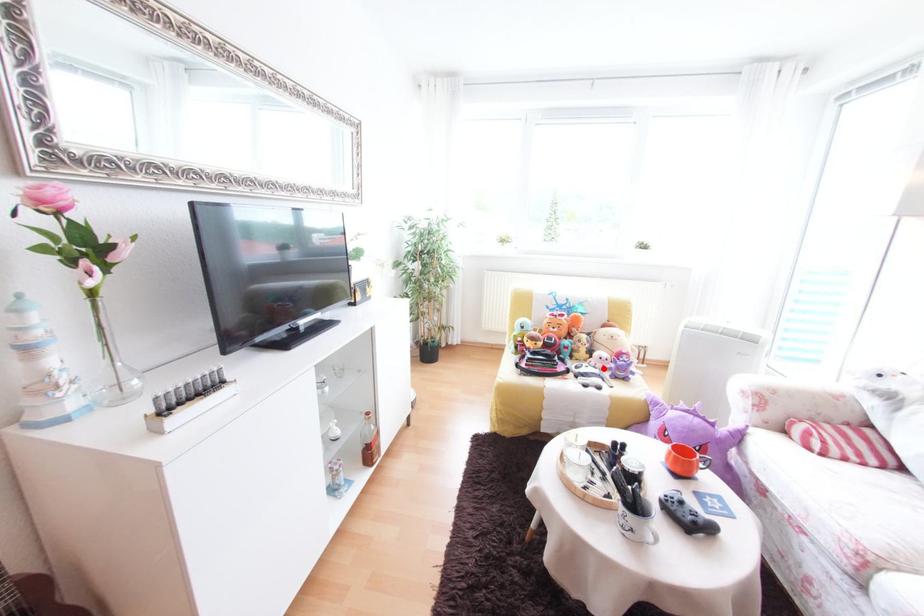
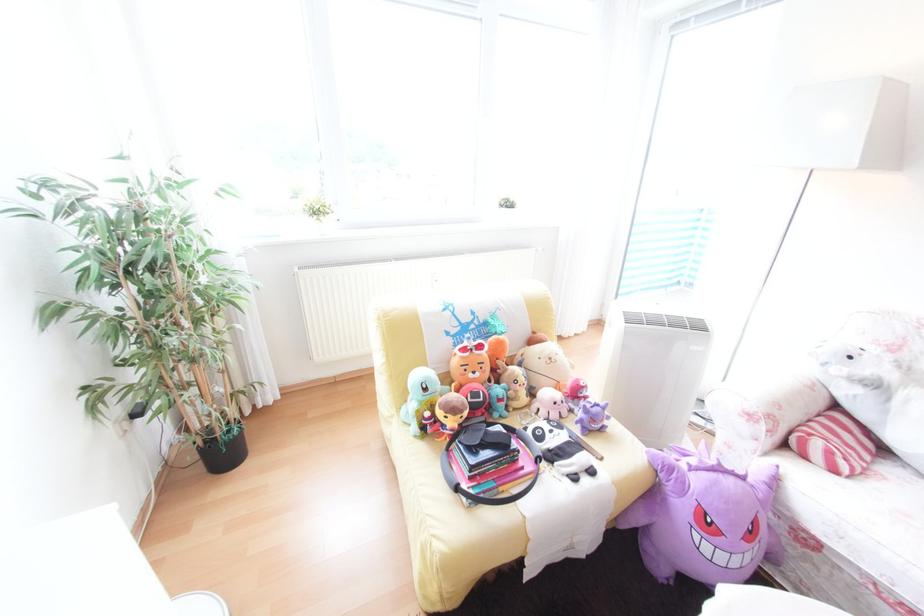
The point at the highlighted location is marked in the first image. Where is the corresponding point in the second image?

(568, 427)